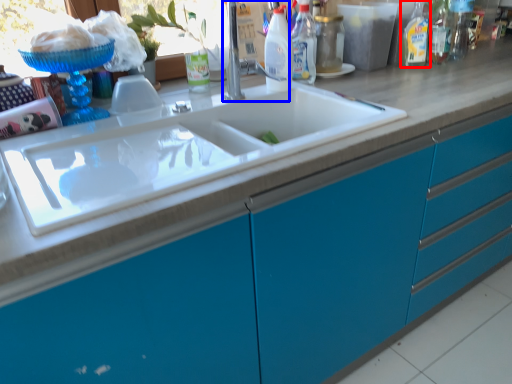
Question: Which object is further to the camera taking this photo, cleaning product (highlighted by a red box) or faucet (highlighted by a blue box)?

Choices:
 (A) cleaning product
 (B) faucet

Answer: (A)